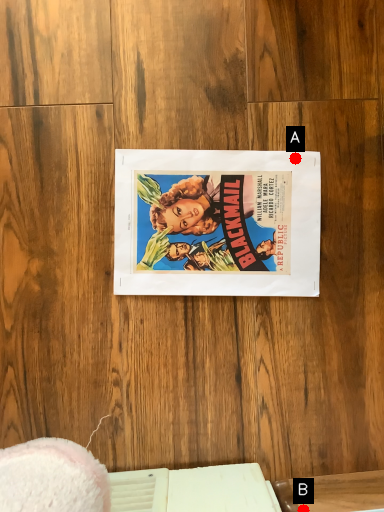
Question: Two points are circled on the image, labeled by A and B beside each circle. Which point is farther to the camera?

Choices:
 (A) A is further
 (B) B is further

Answer: (A)